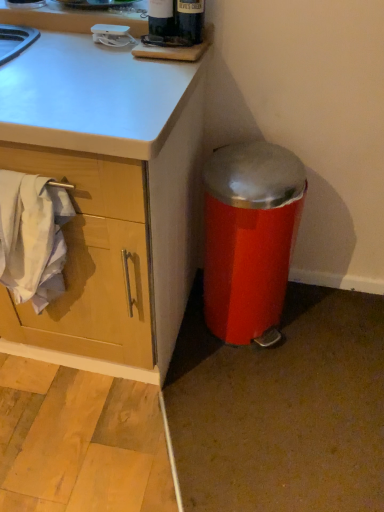
Question: From the image's perspective, is dark glass bottle at upper center located above or below metallic red trash can at lower right?

Choices:
 (A) below
 (B) above

Answer: (B)

Question: Visually, is dark glass bottle at upper center positioned to the left or to the right of metallic red trash can at lower right?

Choices:
 (A) left
 (B) right

Answer: (A)

Question: Based on their relative distances, which object is farther from the dark glass bottle at upper center?

Choices:
 (A) white cotton towel at left
 (B) metallic red trash can at lower right

Answer: (A)

Question: Estimate the real-world distances between objects in this image. Which object is farther from the metallic red trash can at lower right?

Choices:
 (A) white cotton towel at left
 (B) dark glass bottle at upper center

Answer: (B)